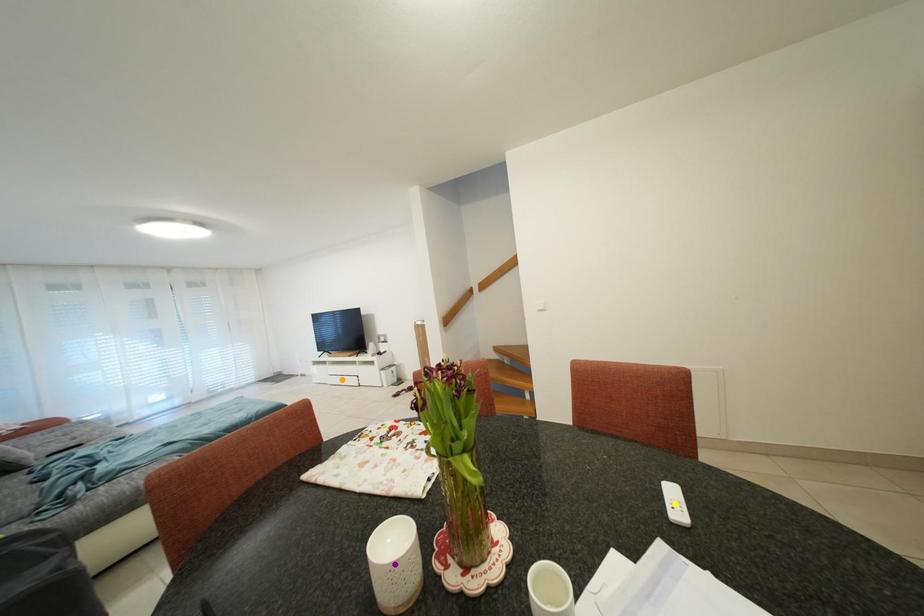
Order these from nearest to farthest:
orange point, purple point, yellow point

purple point
yellow point
orange point